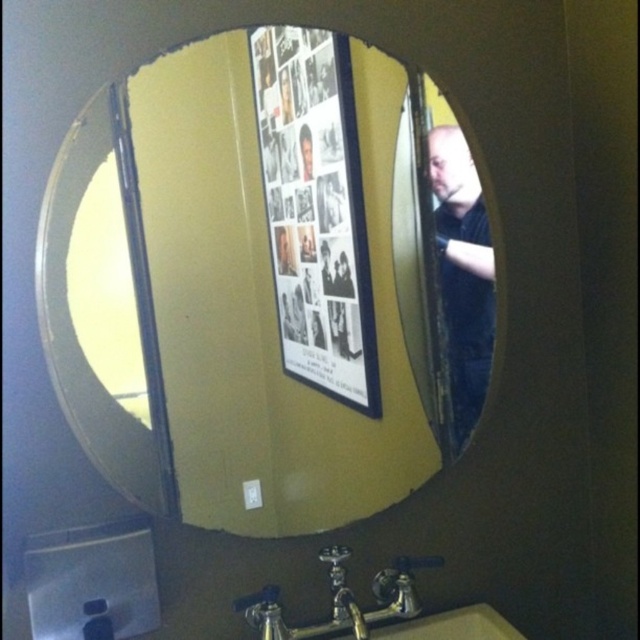
Question: Is matte glass mirror at center positioned at the back of black matte poster at center?

Choices:
 (A) no
 (B) yes

Answer: (A)

Question: Observing the image, what is the correct spatial positioning of black matte poster at center in reference to dark blue shirt at right?

Choices:
 (A) left
 (B) right

Answer: (A)

Question: Which object is positioned closest to the black matte poster at center?

Choices:
 (A) dark blue shirt at right
 (B) matte glass mirror at center

Answer: (B)

Question: Where is matte glass mirror at center located in relation to black matte poster at center in the image?

Choices:
 (A) below
 (B) above

Answer: (A)

Question: Which object is positioned farthest from the black matte poster at center?

Choices:
 (A) matte glass mirror at center
 (B) dark blue shirt at right

Answer: (B)

Question: Which point is farther from the camera taking this photo?

Choices:
 (A) (221, 508)
 (B) (468, 314)

Answer: (B)